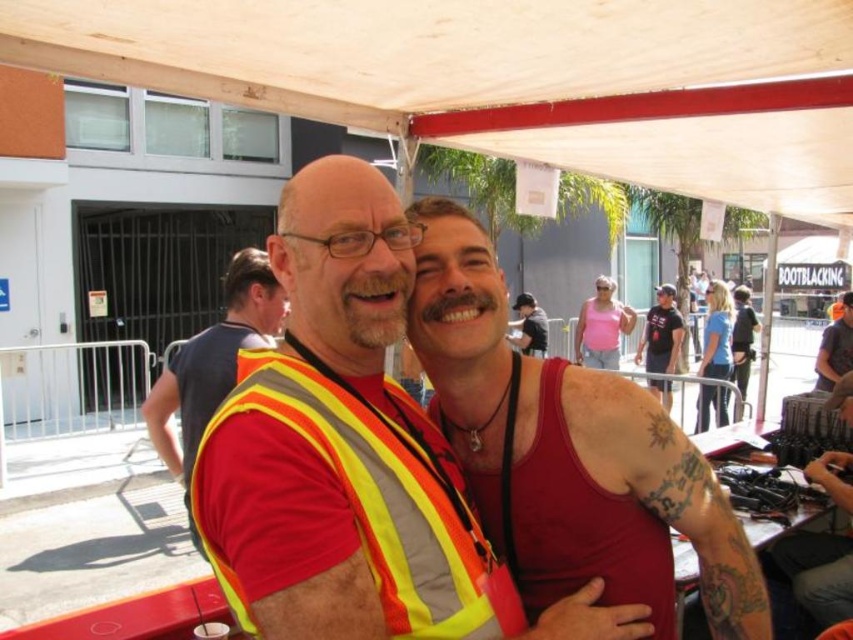
Question: Considering the real-world distances, which object is closest to the pink fabric tank top at center?

Choices:
 (A) red tank top at center
 (B) matte black tank top at center
 (C) reflective yellow safety vest at center

Answer: (B)

Question: In this image, where is red tank top at center located relative to reflective yellow safety vest at center?

Choices:
 (A) above
 (B) below

Answer: (A)

Question: Which object is the farthest from the matte black tank top at center?

Choices:
 (A) red tank top at center
 (B) pink fabric tank top at center

Answer: (A)

Question: Which of the following is the closest to the observer?

Choices:
 (A) red tank top at center
 (B) pink fabric tank top at center

Answer: (A)

Question: Is reflective yellow safety vest at center below pink fabric tank top at center?

Choices:
 (A) yes
 (B) no

Answer: (B)

Question: Does reflective yellow safety vest at center have a larger size compared to matte black tank top at center?

Choices:
 (A) no
 (B) yes

Answer: (A)